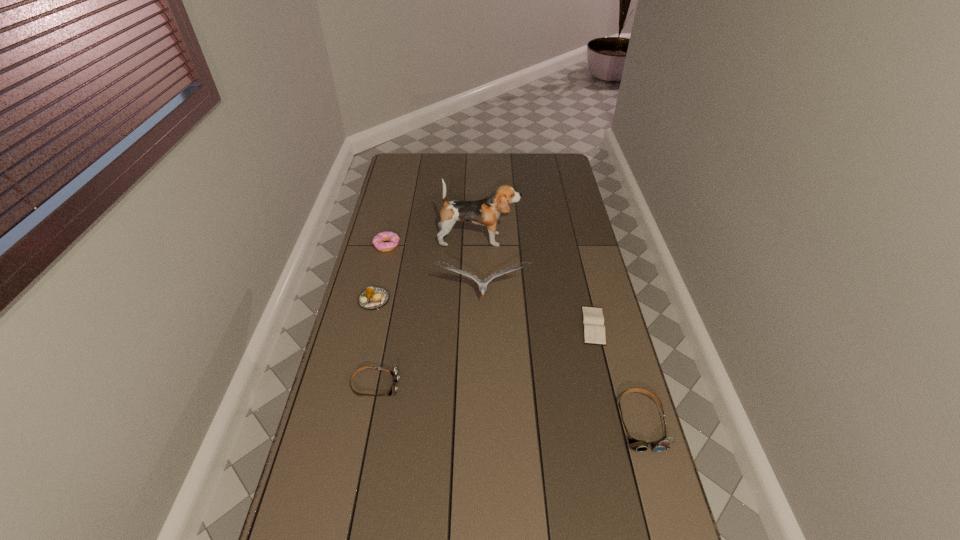
At what (x,y) coordinates should I click in order to perform the action: click on vacant point located between the gull and the doughnut. Please return your answer as a coordinate pair (x, y). Looking at the image, I should click on (435, 271).

This screenshot has width=960, height=540. In order to click on vacant area between the right goggles and the left goggles in this screenshot , I will do `click(508, 404)`.

Find the location of a particular element. empty location between the pastry and the left goggles is located at coordinates (374, 343).

Where is `free spot between the puppy and the diary`? Image resolution: width=960 pixels, height=540 pixels. free spot between the puppy and the diary is located at coordinates (536, 282).

The image size is (960, 540). I want to click on empty space that is in between the right goggles and the puppy, so click(x=560, y=331).

The image size is (960, 540). Find the location of `object that stands as the third closest to the pastry`. object that stands as the third closest to the pastry is located at coordinates (395, 373).

Where is `the third closest object to the third tallest object`? Image resolution: width=960 pixels, height=540 pixels. the third closest object to the third tallest object is located at coordinates tap(395, 373).

Where is `free region that satisfies the following two spatial constraints: 1. at the tip of the beak of the gull; 2. on the right side of the diary`? free region that satisfies the following two spatial constraints: 1. at the tip of the beak of the gull; 2. on the right side of the diary is located at coordinates (483, 326).